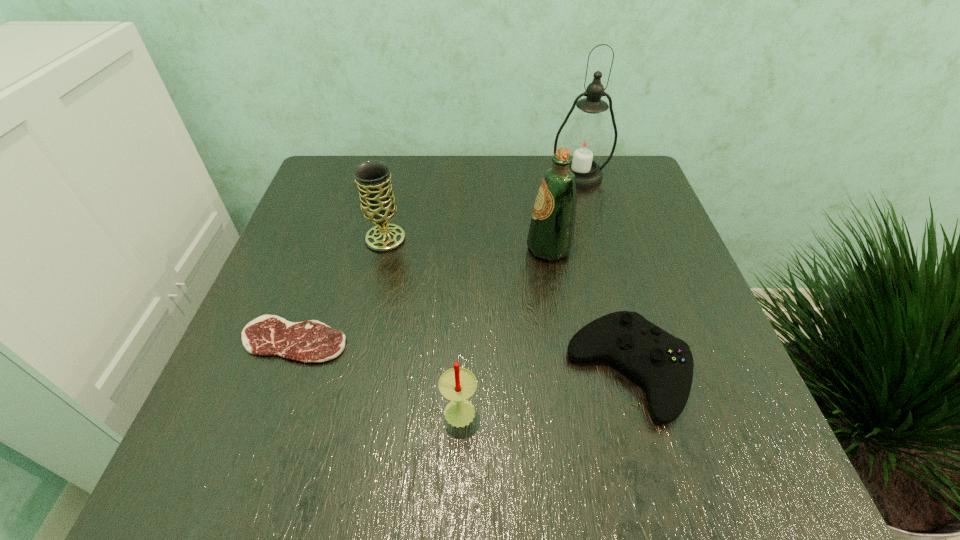
Locate an element on the screen. This screenshot has width=960, height=540. free space that satisfies the following two spatial constraints: 1. on the back side of the candle; 2. on the left side of the fifth tallest object is located at coordinates (461, 371).

This screenshot has height=540, width=960. In order to click on free location that satisfies the following two spatial constraints: 1. on the back side of the third shortest object; 2. on the left side of the control in this screenshot , I will do `click(461, 371)`.